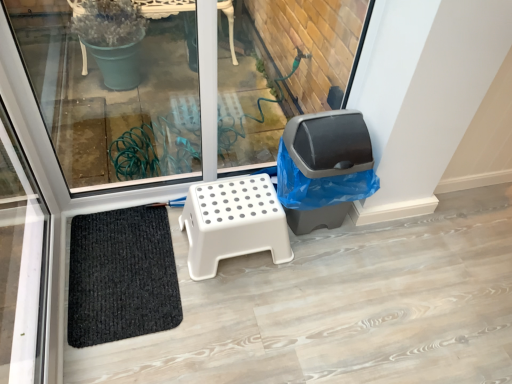
Identify the location of white plastic stool at center. (233, 222).

This screenshot has height=384, width=512. What do you see at coordinates (114, 98) in the screenshot?
I see `transparent glass window at center` at bounding box center [114, 98].

Locate an element on the screen. black woven mat at lower left is located at coordinates (121, 276).

Is transparent glass window at center positioned with its back to black woven mat at lower left?

No, black woven mat at lower left is not at the back of transparent glass window at center.

Would you say transparent glass window at center contains black woven mat at lower left?

That's incorrect, black woven mat at lower left is not inside transparent glass window at center.

Does point (21, 55) appear closer or farther from the camera than point (110, 216)?

Point (21, 55) appears to be farther away from the viewer than point (110, 216).

Does transparent glass window at center lie in front of black woven mat at lower left?

Yes, transparent glass window at center is closer to the viewer.

In the scene shown: Is black woven mat at lower left not within transparent glass window at center?

That's correct, black woven mat at lower left is outside of transparent glass window at center.

Which object is positioned more to the right, black woven mat at lower left or transparent glass window at center?

From the viewer's perspective, transparent glass window at center appears more on the right side.

Considering the relative sizes of black woven mat at lower left and transparent glass window at center in the image provided, is black woven mat at lower left bigger than transparent glass window at center?

Actually, black woven mat at lower left might be smaller than transparent glass window at center.

From the image's perspective, is black woven mat at lower left on transparent glass window at center?

No, from the image's perspective, black woven mat at lower left is not above transparent glass window at center.

How far apart are white plastic stool at center and transparent glass window at center?

The distance of white plastic stool at center from transparent glass window at center is 33.89 inches.

Considering the sizes of white plastic stool at center and transparent glass window at center in the image, is white plastic stool at center wider or thinner than transparent glass window at center?

Considering their sizes, white plastic stool at center looks broader than transparent glass window at center.

At what (x,y) coordinates should I click in order to perform the action: click on window in front of the white plastic stool at center. Please return your answer as a coordinate pair (x, y). Looking at the image, I should click on (114, 98).

Between point (222, 221) and point (60, 116), which one is positioned in front?

The point (222, 221) is more forward.

Which is correct: black woven mat at lower left is inside gray plastic trash can at center right, or outside of it?

black woven mat at lower left is not enclosed by gray plastic trash can at center right.

Is black woven mat at lower left beside gray plastic trash can at center right?

black woven mat at lower left and gray plastic trash can at center right are clearly separated.

Is black woven mat at lower left to the left of gray plastic trash can at center right from the viewer's perspective?

Yes.

How different are the orientations of white plastic stool at center and black woven mat at lower left in degrees?

The angular difference between white plastic stool at center and black woven mat at lower left is 87.8 degrees.

From a real-world perspective, is white plastic stool at center beneath black woven mat at lower left?

Actually, white plastic stool at center is physically above black woven mat at lower left in the real world.

Can you confirm if white plastic stool at center is shorter than black woven mat at lower left?

In fact, white plastic stool at center may be taller than black woven mat at lower left.

Considering the positions of objects white plastic stool at center and black woven mat at lower left in the image provided, who is more to the left, white plastic stool at center or black woven mat at lower left?

black woven mat at lower left is more to the left.

Considering the positions of objects transparent glass window at center and gray plastic trash can at center right in the image provided, who is more to the right, transparent glass window at center or gray plastic trash can at center right?

From the viewer's perspective, gray plastic trash can at center right appears more on the right side.

Is point (179, 29) closer to camera compared to point (343, 172)?

No.

How different are the orientations of transparent glass window at center and gray plastic trash can at center right in degrees?

There is a 2.52-degree angle between the facing directions of transparent glass window at center and gray plastic trash can at center right.

From the image's perspective, which one is positioned lower, transparent glass window at center or white plastic stool at center?

white plastic stool at center.

Considering the sizes of objects transparent glass window at center and white plastic stool at center in the image provided, who is bigger, transparent glass window at center or white plastic stool at center?

Bigger between the two is transparent glass window at center.

Based on the photo, is white plastic stool at center located within transparent glass window at center?

No.

The width and height of the screenshot is (512, 384). I want to click on window that is in front of the black woven mat at lower left, so click(114, 98).

The width and height of the screenshot is (512, 384). I want to click on doormat below the transparent glass window at center (from a real-world perspective), so click(x=121, y=276).

Based on their spatial positions, is gray plastic trash can at center right or black woven mat at lower left closer to transparent glass window at center?

The object closer to transparent glass window at center is black woven mat at lower left.

When comparing their distances from gray plastic trash can at center right, does white plastic stool at center or black woven mat at lower left seem closer?

white plastic stool at center is positioned closer to the anchor gray plastic trash can at center right.

Which object lies nearer to the anchor point white plastic stool at center, transparent glass window at center or gray plastic trash can at center right?

gray plastic trash can at center right.

From the image, which object appears to be farther from gray plastic trash can at center right, black woven mat at lower left or white plastic stool at center?

Among the two, black woven mat at lower left is located further to gray plastic trash can at center right.

Based on their spatial positions, is white plastic stool at center or gray plastic trash can at center right closer to transparent glass window at center?

white plastic stool at center is closer to transparent glass window at center.

Looking at the image, which one is located closer to black woven mat at lower left, gray plastic trash can at center right or white plastic stool at center?

The object closer to black woven mat at lower left is white plastic stool at center.

When comparing their distances from black woven mat at lower left, does transparent glass window at center or white plastic stool at center seem further?

The object further to black woven mat at lower left is transparent glass window at center.

Estimate the real-world distances between objects in this image. Which object is closer to gray plastic trash can at center right, white plastic stool at center or transparent glass window at center?

white plastic stool at center is closer to gray plastic trash can at center right.

You are a GUI agent. You are given a task and a screenshot of the screen. Output one action in this format:
    pyautogui.click(x=<x>, y=<y>)
    Task: Click on the furniture between black woven mat at lower left and gray plastic trash can at center right
    This screenshot has width=512, height=384.
    Given the screenshot: What is the action you would take?
    pyautogui.click(x=233, y=222)

Find the location of a particular element. This screenshot has width=512, height=384. window situated between black woven mat at lower left and gray plastic trash can at center right from left to right is located at coordinates (114, 98).

The image size is (512, 384). Identify the location of furniture between transparent glass window at center and black woven mat at lower left in the up-down direction. (233, 222).

I want to click on furniture between transparent glass window at center and gray plastic trash can at center right in the horizontal direction, so click(233, 222).